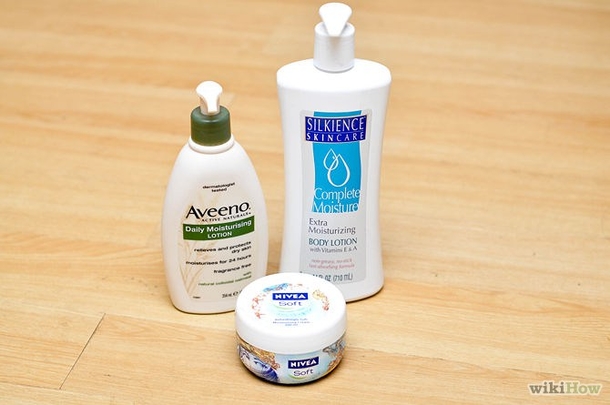
I want to click on small round container, so click(296, 341).